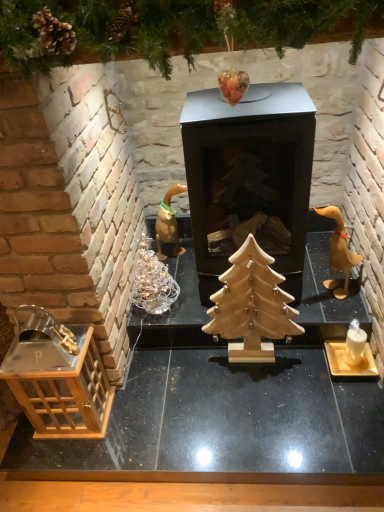
Image resolution: width=384 pixels, height=512 pixels. I want to click on free space between natural wood christmas tree at center and transparent glass lantern at lower left, so click(178, 390).